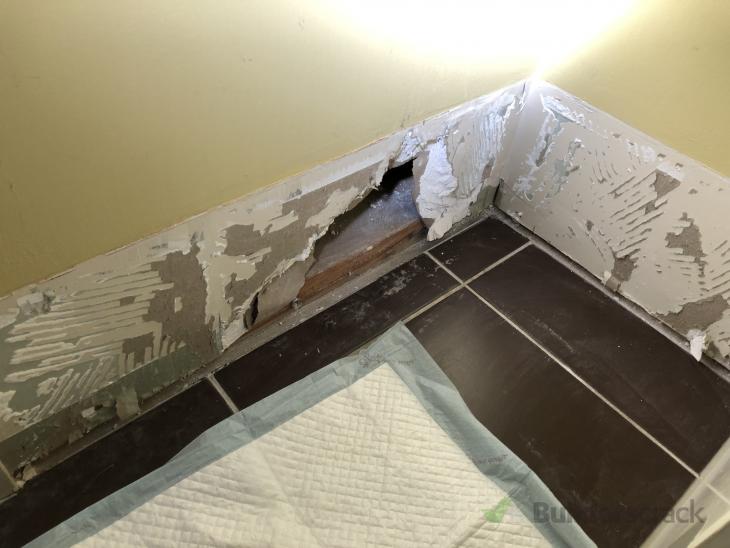
Where is `grout`? grout is located at coordinates (222, 393), (464, 286).